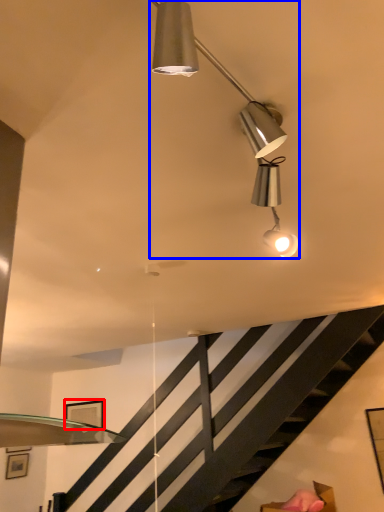
Question: Which object is further to the camera taking this photo, picture frame (highlighted by a red box) or lamp (highlighted by a blue box)?

Choices:
 (A) picture frame
 (B) lamp

Answer: (A)